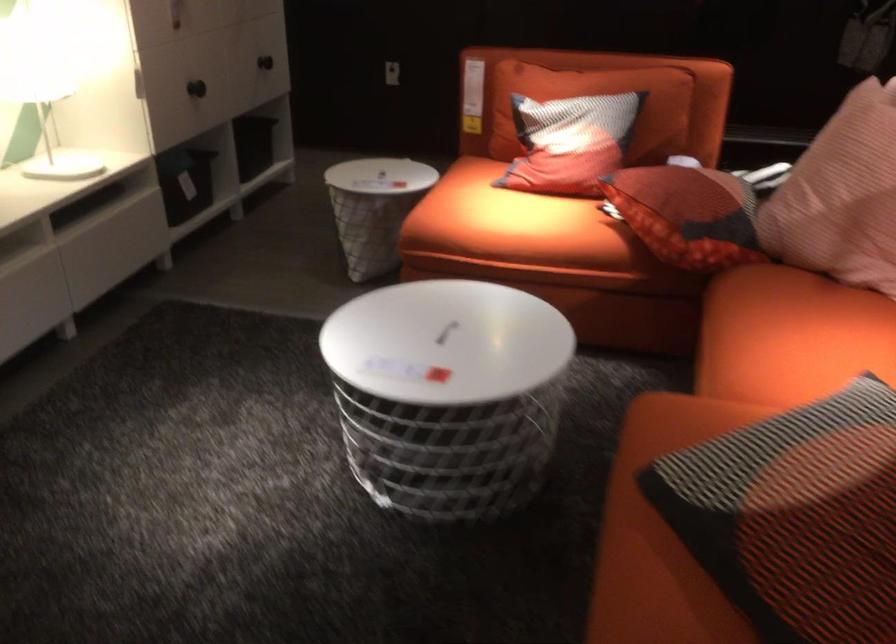
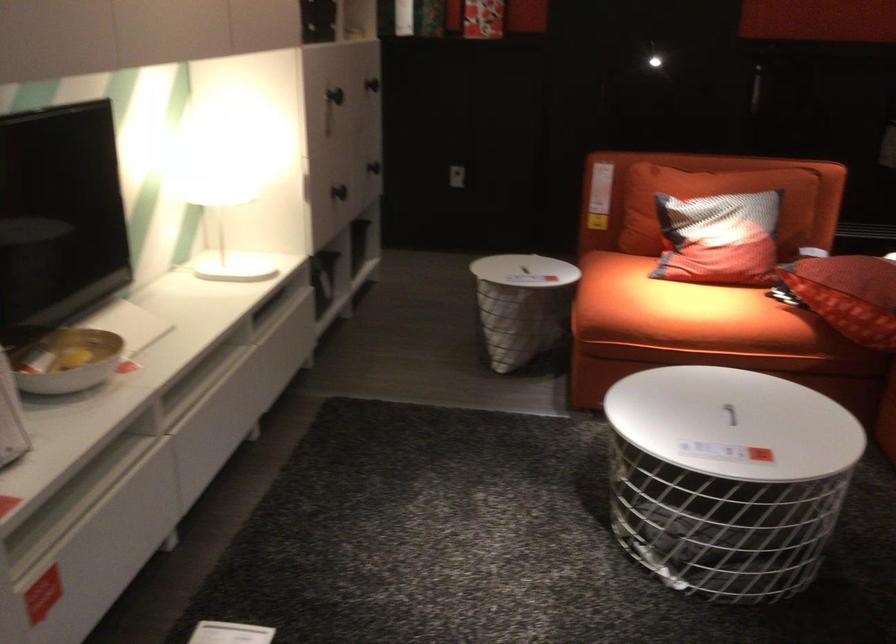
The point at (501, 223) is marked in the first image. Where is the corresponding point in the second image?

(684, 312)